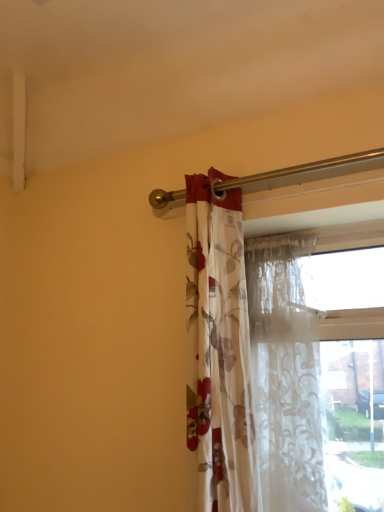
Question: Is floral fabric curtain at center, placed as the 1th curtain when sorted from left to right, wider or thinner than translucent floral fabric at center, arranged as the second curtain when viewed from the left?

Choices:
 (A) thin
 (B) wide

Answer: (B)

Question: Relative to translucent floral fabric at center, arranged as the second curtain when viewed from the left, is floral fabric curtain at center, placed as the 1th curtain when sorted from left to right, in front or behind?

Choices:
 (A) behind
 (B) front

Answer: (B)

Question: From their relative heights in the image, would you say floral fabric curtain at center, the second curtain from the right, is taller or shorter than translucent floral fabric at center, acting as the 1th curtain starting from the right?

Choices:
 (A) tall
 (B) short

Answer: (A)

Question: Is point (304, 347) positioned closer to the camera than point (188, 232)?

Choices:
 (A) farther
 (B) closer

Answer: (A)

Question: Considering the positions of translucent floral fabric at center, arranged as the second curtain when viewed from the left, and floral fabric curtain at center, the second curtain from the right, in the image, is translucent floral fabric at center, arranged as the second curtain when viewed from the left, bigger or smaller than floral fabric curtain at center, the second curtain from the right,?

Choices:
 (A) big
 (B) small

Answer: (B)

Question: From a real-world perspective, is translucent floral fabric at center, arranged as the second curtain when viewed from the left, positioned above or below floral fabric curtain at center, the second curtain from the right?

Choices:
 (A) above
 (B) below

Answer: (B)

Question: Considering their positions, is translucent floral fabric at center, acting as the 1th curtain starting from the right, located in front of or behind floral fabric curtain at center, placed as the 1th curtain when sorted from left to right?

Choices:
 (A) front
 (B) behind

Answer: (B)